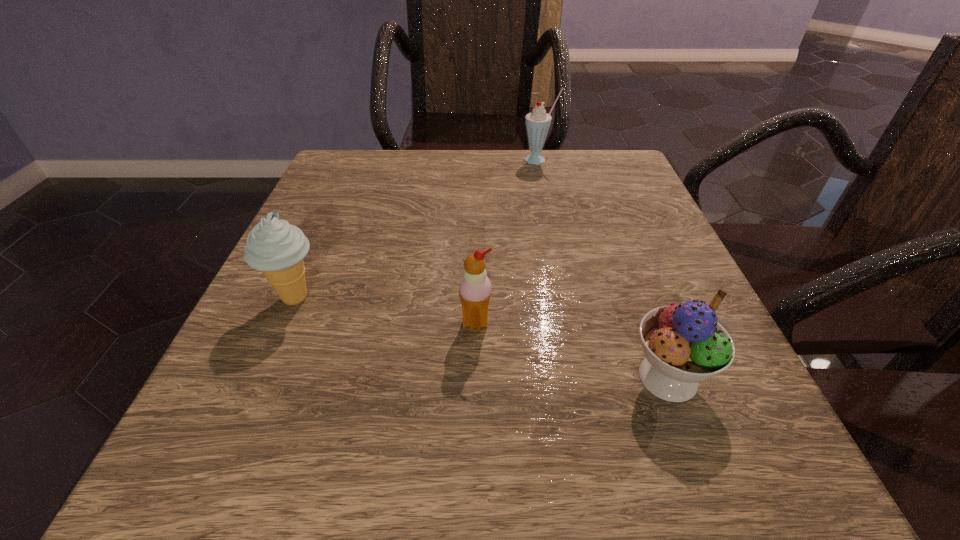
The image size is (960, 540). What are the coordinates of `free space between the milkshake and the second icecream from left to right` in the screenshot? It's located at (508, 242).

This screenshot has height=540, width=960. Identify the location of free space that is in between the leftmost icecream and the milkshake. (418, 229).

Identify the location of free point between the leftmost icecream and the rightmost object. The height and width of the screenshot is (540, 960). (482, 338).

Locate an element on the screen. empty space that is in between the second object from left to right and the third object from left to right is located at coordinates (508, 242).

The width and height of the screenshot is (960, 540). I want to click on free point between the rightmost icecream and the leftmost icecream, so point(482,338).

Image resolution: width=960 pixels, height=540 pixels. I want to click on free space between the third object from right to left and the leftmost icecream, so click(x=386, y=310).

Image resolution: width=960 pixels, height=540 pixels. Find the location of `free space that is in between the leftmost icecream and the second icecream from right to left`. free space that is in between the leftmost icecream and the second icecream from right to left is located at coordinates (386, 310).

Locate an element on the screen. This screenshot has height=540, width=960. vacant area that lies between the leftmost icecream and the third object from right to left is located at coordinates (386, 310).

This screenshot has height=540, width=960. I want to click on free space between the third object from left to right and the third object from right to left, so click(508, 242).

You are a GUI agent. You are given a task and a screenshot of the screen. Output one action in this format:
    pyautogui.click(x=<x>, y=<y>)
    Task: Click on the free space between the second icecream from right to left and the milkshake
    The height and width of the screenshot is (540, 960).
    Given the screenshot: What is the action you would take?
    pyautogui.click(x=508, y=242)